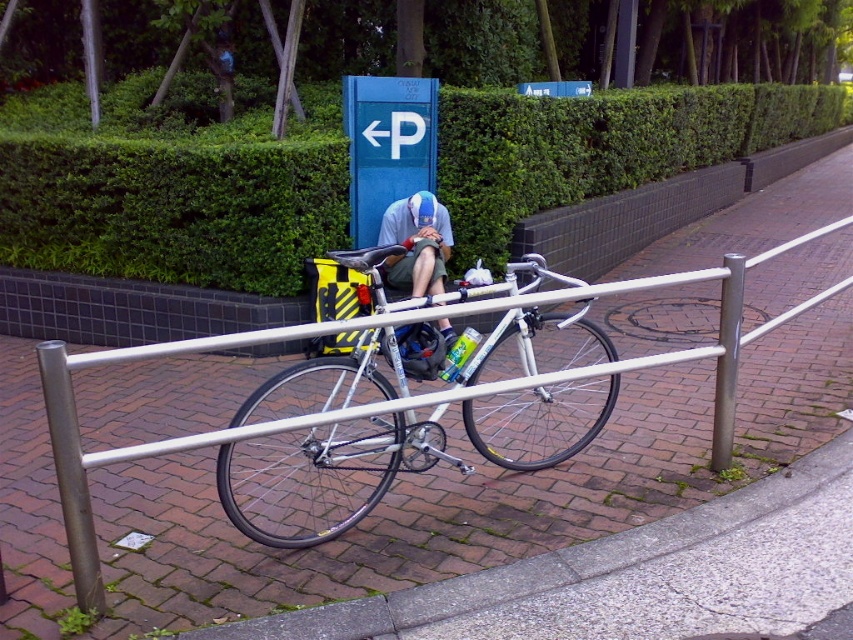
You are a delivery person who needs to navigate through this area. You see the green leafy hedge at upper center and the light blue fabric cap at center. Which object is bigger in size?

The green leafy hedge at upper center is larger in size compared to the light blue fabric cap at center.

You are a pedestrian trying to navigate through the pathway. You see the green leafy hedge at upper center and the white metallic bicycle at center. Which object is positioned to the right side of the other?

The green leafy hedge at upper center is positioned to the right of the white metallic bicycle at center.